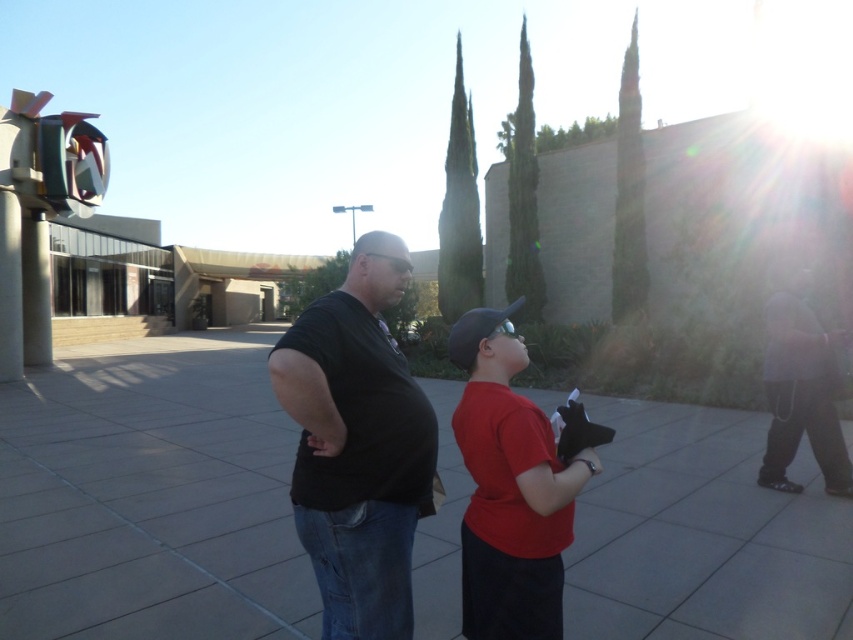
Question: Which point appears farthest from the camera in this image?

Choices:
 (A) (44, 611)
 (B) (466, 596)
 (C) (395, 572)

Answer: (A)

Question: Is black matte shirt at center bigger than red matte shirt at center?

Choices:
 (A) no
 (B) yes

Answer: (B)

Question: Considering the real-world distances, which object is closest to the black matte shirt at center?

Choices:
 (A) red matte shirt at center
 (B) gray concrete pavement at center

Answer: (A)

Question: Is black matte shirt at center below red matte shirt at center?

Choices:
 (A) yes
 (B) no

Answer: (A)

Question: Can you confirm if gray concrete pavement at center is wider than red matte shirt at center?

Choices:
 (A) yes
 (B) no

Answer: (A)

Question: Which is farther from the black matte shirt at center?

Choices:
 (A) red matte shirt at center
 (B) gray concrete pavement at center

Answer: (B)